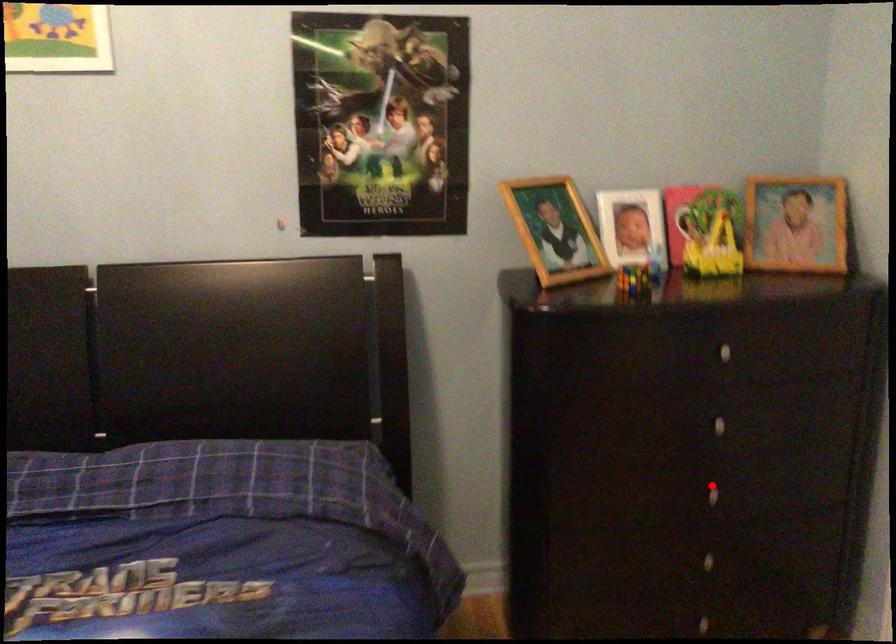
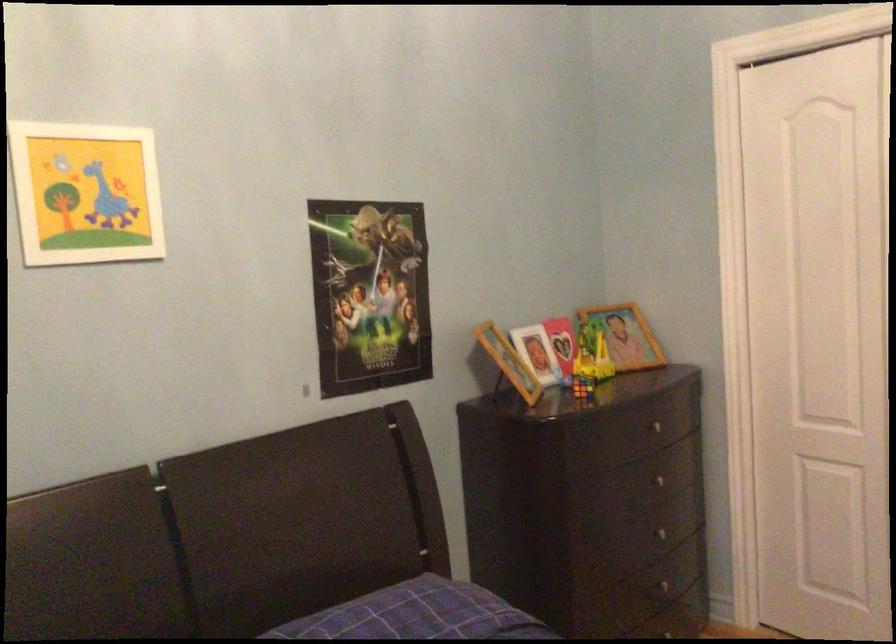
Question: I am providing you with two images of the same scene from different viewpoints. Given a red point in image1, look at the same physical point in image2. Is it:

Choices:
 (A) Closer to the viewpoint
 (B) Farther from the viewpoint

Answer: (B)